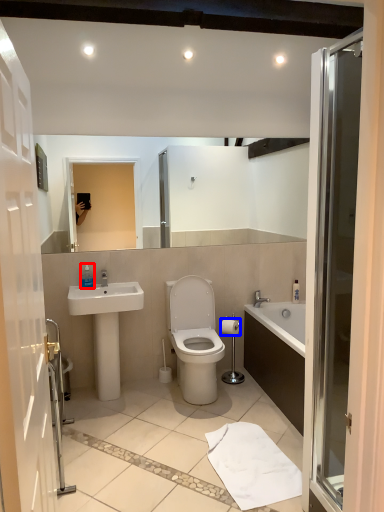
Question: Which object appears farthest to the camera in this image, toiletry (highlighted by a red box) or toilet paper (highlighted by a blue box)?

Choices:
 (A) toiletry
 (B) toilet paper

Answer: (B)